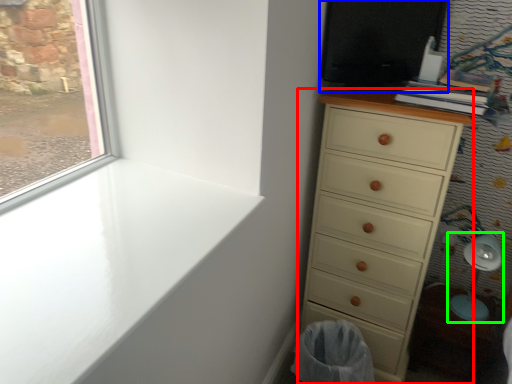
Question: Considering the real-world distances, which object is closest to chest of drawers (highlighted by a red box)? screen door (highlighted by a blue box) or swivel chair (highlighted by a green box).

Choices:
 (A) screen door
 (B) swivel chair

Answer: (A)